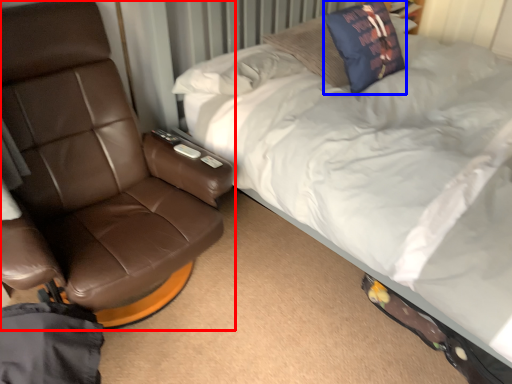
Question: Which point is closer to the camera, chair (highlighted by a red box) or throw pillow (highlighted by a blue box)?

Choices:
 (A) chair
 (B) throw pillow

Answer: (A)